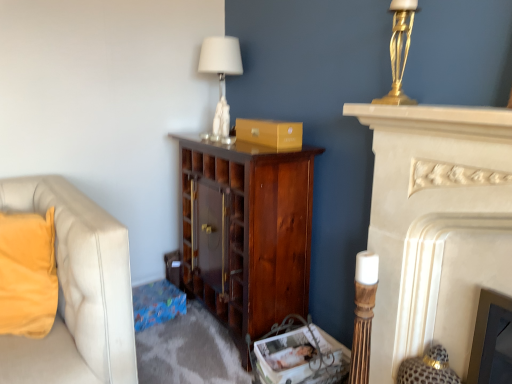
Question: Can you confirm if dark wood cabinet at center is shorter than white marble fireplace at right?

Choices:
 (A) no
 (B) yes

Answer: (B)

Question: From the image's perspective, is dark wood cabinet at center located above white marble fireplace at right?

Choices:
 (A) no
 (B) yes

Answer: (B)

Question: From a real-world perspective, is dark wood cabinet at center beneath white marble fireplace at right?

Choices:
 (A) yes
 (B) no

Answer: (A)

Question: Considering the relative positions of dark wood cabinet at center and white marble fireplace at right in the image provided, is dark wood cabinet at center in front of white marble fireplace at right?

Choices:
 (A) no
 (B) yes

Answer: (A)

Question: Does dark wood cabinet at center lie behind white marble fireplace at right?

Choices:
 (A) no
 (B) yes

Answer: (B)

Question: Considering the relative sizes of dark wood cabinet at center and white marble fireplace at right in the image provided, is dark wood cabinet at center wider than white marble fireplace at right?

Choices:
 (A) yes
 (B) no

Answer: (A)

Question: Does dark wood cabinet at center have a larger size compared to white fabric lampshade at upper center?

Choices:
 (A) yes
 (B) no

Answer: (A)

Question: Could white fabric lampshade at upper center be considered to be inside dark wood cabinet at center?

Choices:
 (A) no
 (B) yes

Answer: (A)

Question: Is dark wood cabinet at center far from white fabric lampshade at upper center?

Choices:
 (A) yes
 (B) no

Answer: (B)

Question: Considering the relative sizes of dark wood cabinet at center and white fabric lampshade at upper center in the image provided, is dark wood cabinet at center thinner than white fabric lampshade at upper center?

Choices:
 (A) no
 (B) yes

Answer: (A)

Question: Is dark wood cabinet at center located outside white fabric lampshade at upper center?

Choices:
 (A) no
 (B) yes

Answer: (B)

Question: Is dark wood cabinet at center positioned in front of white fabric lampshade at upper center?

Choices:
 (A) yes
 (B) no

Answer: (A)

Question: From a real-world perspective, is dark wood cabinet at center beneath matte gold cardboard box at center?

Choices:
 (A) no
 (B) yes

Answer: (B)